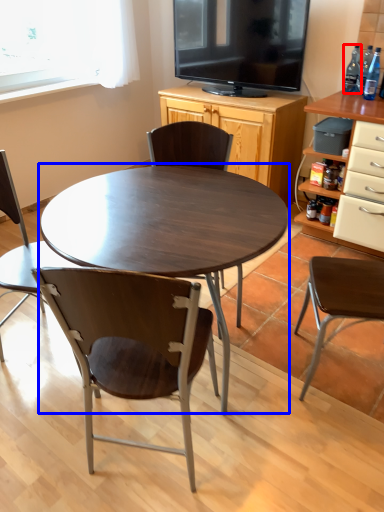
Question: Which object appears closest to the camera in this image, bottle (highlighted by a red box) or coffee table (highlighted by a blue box)?

Choices:
 (A) bottle
 (B) coffee table

Answer: (B)